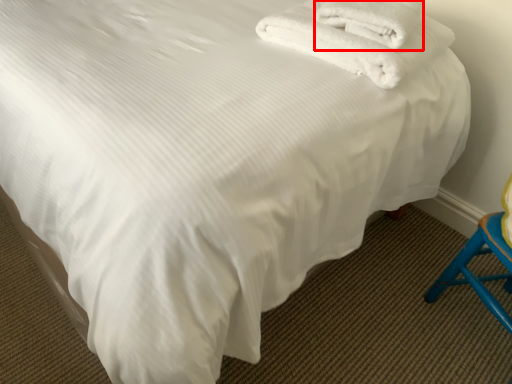
Question: From the image's perspective, where is towel (annotated by the red box) located in relation to towel in the image?

Choices:
 (A) below
 (B) above

Answer: (B)